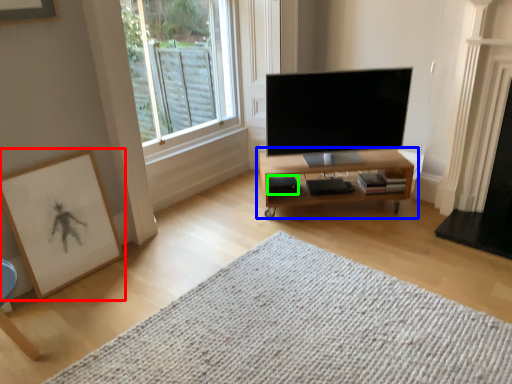
Question: Which is farther away from picture frame (highlighted by a red box)? table (highlighted by a blue box) or speaker (highlighted by a green box)?

Choices:
 (A) table
 (B) speaker

Answer: (A)